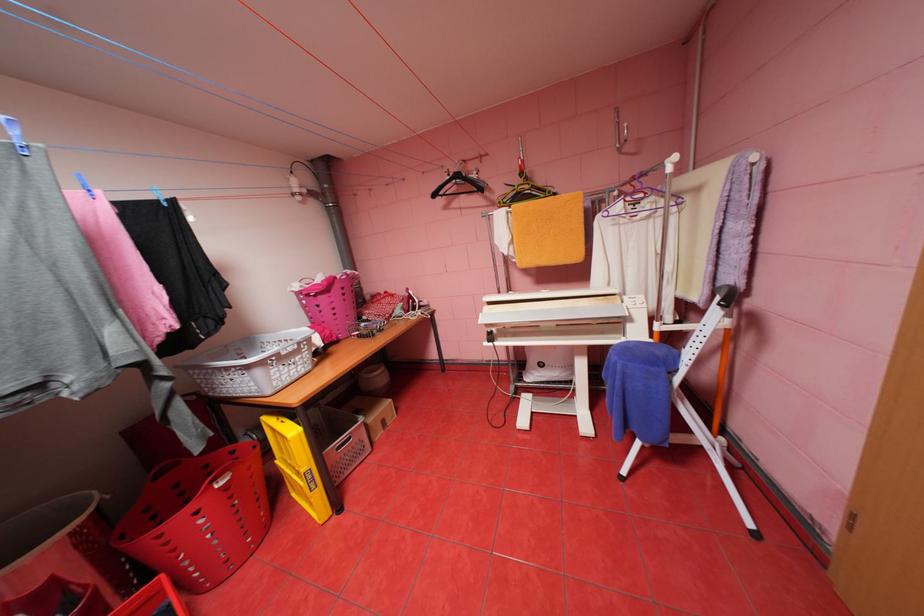
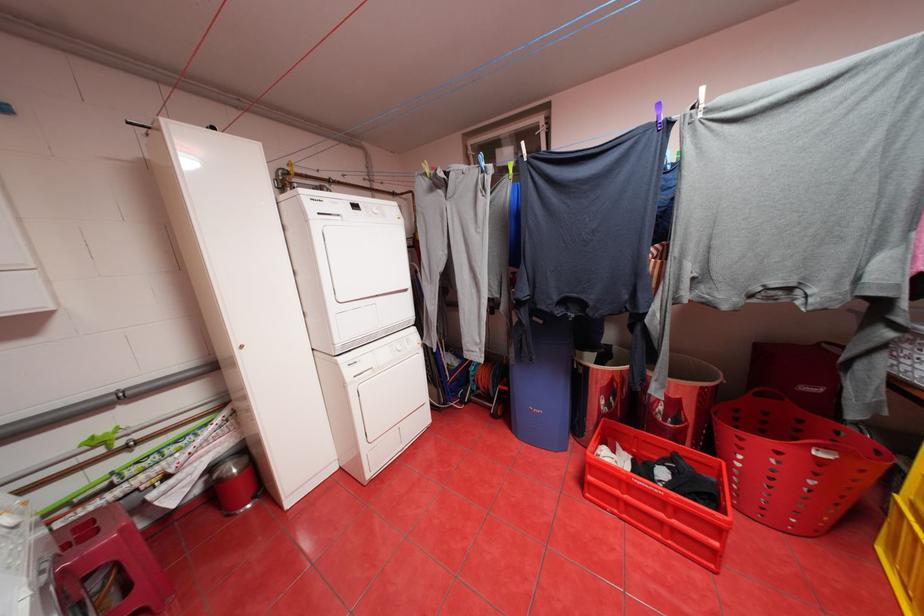
Locate, in the second image, the point that corresponds to (x=227, y=484) in the first image.

(828, 453)